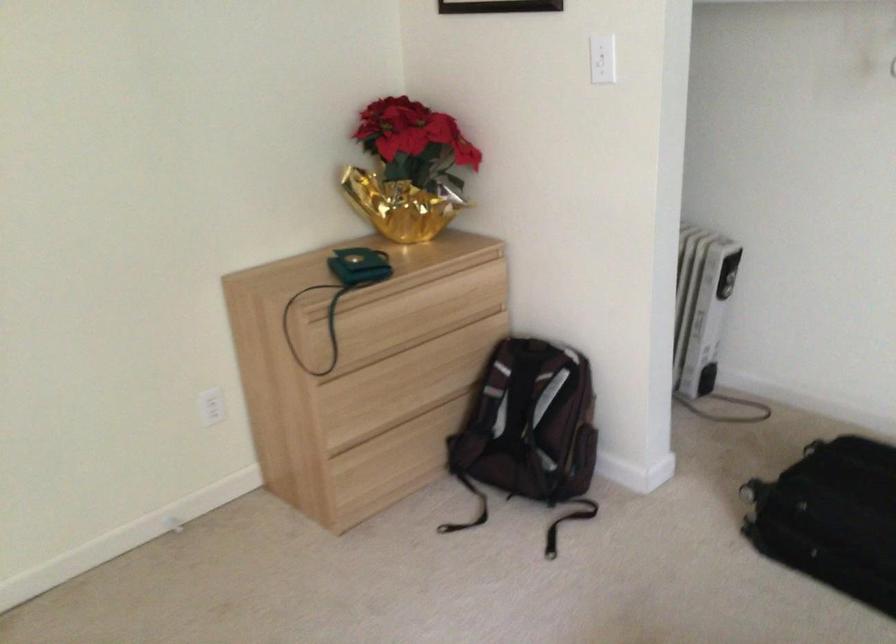
Where would you pull the bottom drawer pull? Please return your answer as a coordinate pair (x, y).

(382, 478)